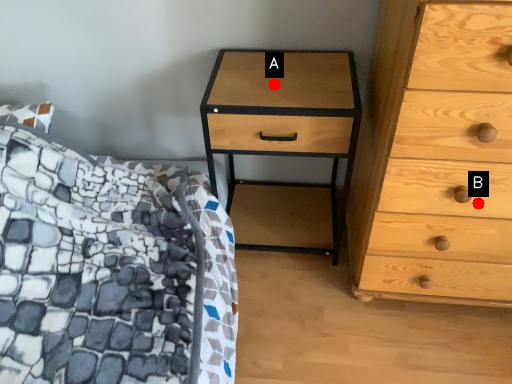
Question: Two points are circled on the image, labeled by A and B beside each circle. Which point appears closest to the camera in this image?

Choices:
 (A) A is closer
 (B) B is closer

Answer: (B)